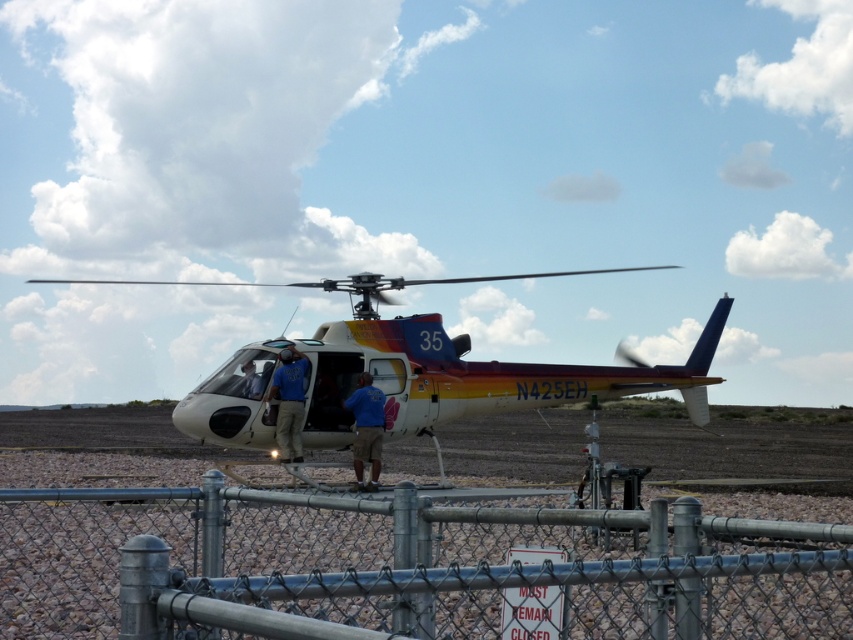
Question: Is metal chain-link fence at lower center smaller than white glossy helicopter at center?

Choices:
 (A) no
 (B) yes

Answer: (B)

Question: Can you confirm if white glossy helicopter at center is positioned above blue fabric shirt at center?

Choices:
 (A) yes
 (B) no

Answer: (A)

Question: Can you confirm if white glossy helicopter at center is wider than blue fabric shirt at center?

Choices:
 (A) no
 (B) yes

Answer: (B)

Question: Which of the following is the closest to the observer?

Choices:
 (A) (247, 497)
 (B) (289, 401)
 (C) (355, 428)
 (D) (242, 365)

Answer: (A)

Question: Which object is positioned farthest from the metal chain-link fence at lower center?

Choices:
 (A) white glossy helicopter at center
 (B) blue fabric shirt at center
 (C) matte blue helmet at center
 (D) blue cotton shirt at center

Answer: (A)

Question: Which point is closer to the camera?

Choices:
 (A) (289, 358)
 (B) (415, 406)
 (C) (361, 474)

Answer: (A)